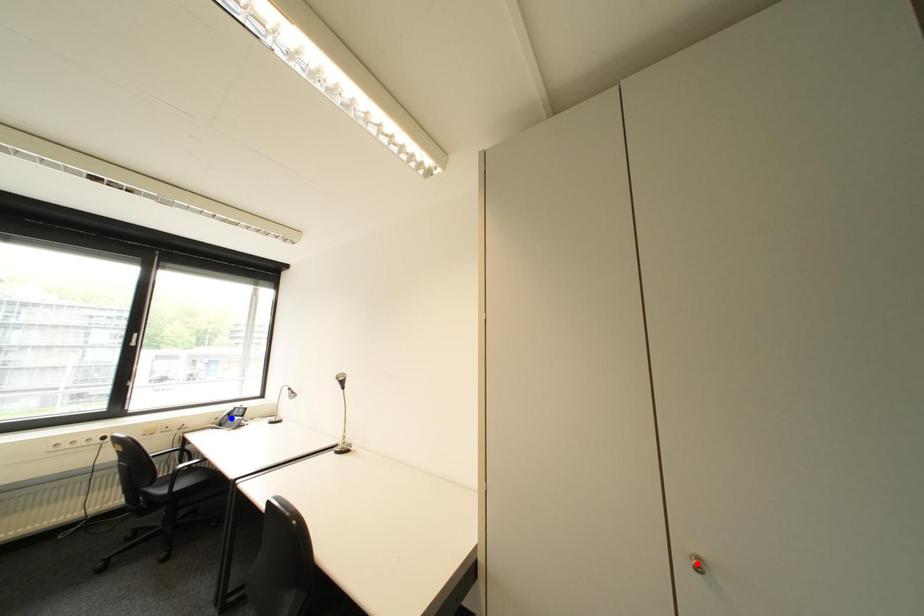
Question: Which of the two points in the image is closer to the camera?

Choices:
 (A) Blue point is closer.
 (B) Red point is closer.

Answer: (B)